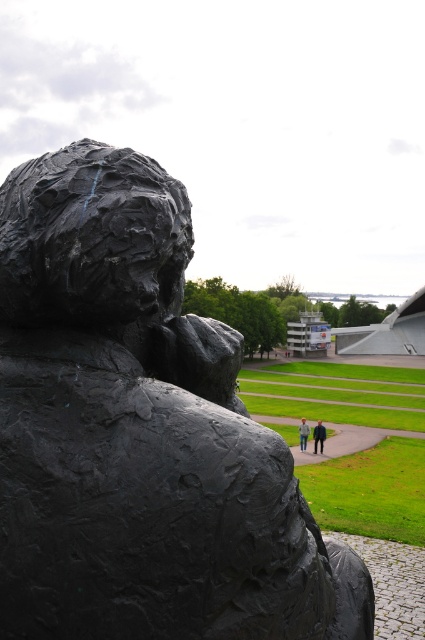
From the picture: You are standing in front of the black matte sculpture at center and want to take a photo of it. If your camera has a maximum focus range of 4 feet, will you be able to capture the sculpture clearly?

The black matte sculpture at center is 3.93 feet away from camera, so yes, the camera can focus on it clearly since the distance is within the 4 feet range.

Consider the image. You are an art curator planning to move the black matte sculpture at center and the light blue jeans at center to a new exhibition space. The entrance has a height restriction of 2 meters. Which object might require checking the height clearance first?

The black matte sculpture at center is larger in size than light blue jeans at center, so it might require checking the height clearance first since it is taller.

You are an art curator planning to display the black matte sculpture at center and the blue jeans at center in an exhibition. Given their sizes, which object should be placed on a higher pedestal to ensure both are visible to visitors standing at the same viewing angle?

The black matte sculpture at center has a smaller size compared to blue jeans at center, so it should be placed on a higher pedestal to ensure visibility.